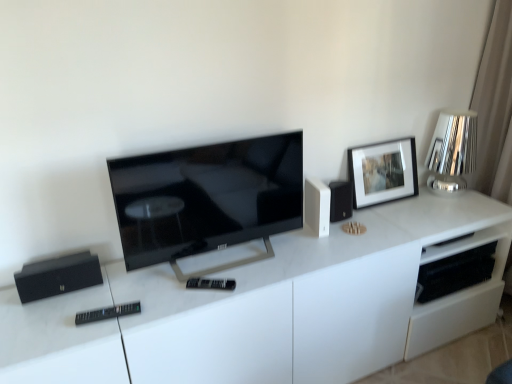
The height and width of the screenshot is (384, 512). Identify the location of vacant space in front of white matte speaker at upper right. (318, 254).